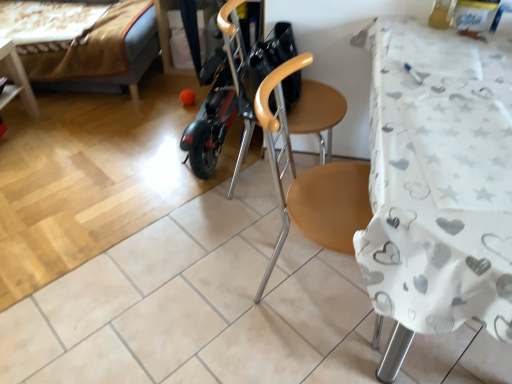
Question: Is velvet brown bed at upper left taller or shorter than wooden swivel chair at center?

Choices:
 (A) short
 (B) tall

Answer: (A)

Question: Is velvet brown bed at upper left spatially inside wooden swivel chair at center, or outside of it?

Choices:
 (A) inside
 (B) outside

Answer: (B)

Question: Which object is positioned farthest from the velvet brown bed at upper left?

Choices:
 (A) white fabric-covered table at right
 (B) wooden chair at center
 (C) wooden swivel chair at center

Answer: (A)

Question: Which of these objects is positioned farthest from the wooden chair at center?

Choices:
 (A) velvet brown bed at upper left
 (B) wooden swivel chair at center
 (C) white fabric-covered table at right

Answer: (A)